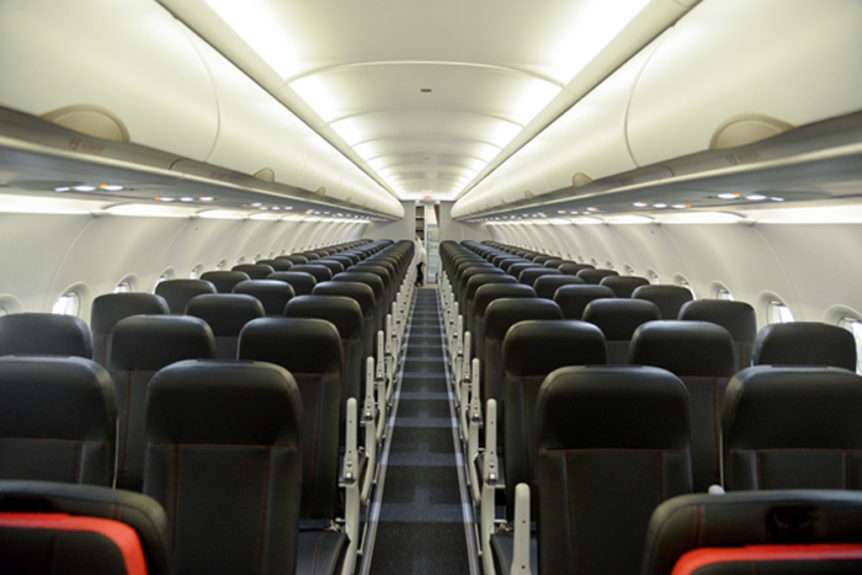
Where is `compartment handles`? compartment handles is located at coordinates (72, 122), (266, 181), (325, 189), (347, 201), (503, 201), (578, 181), (531, 191), (740, 132).